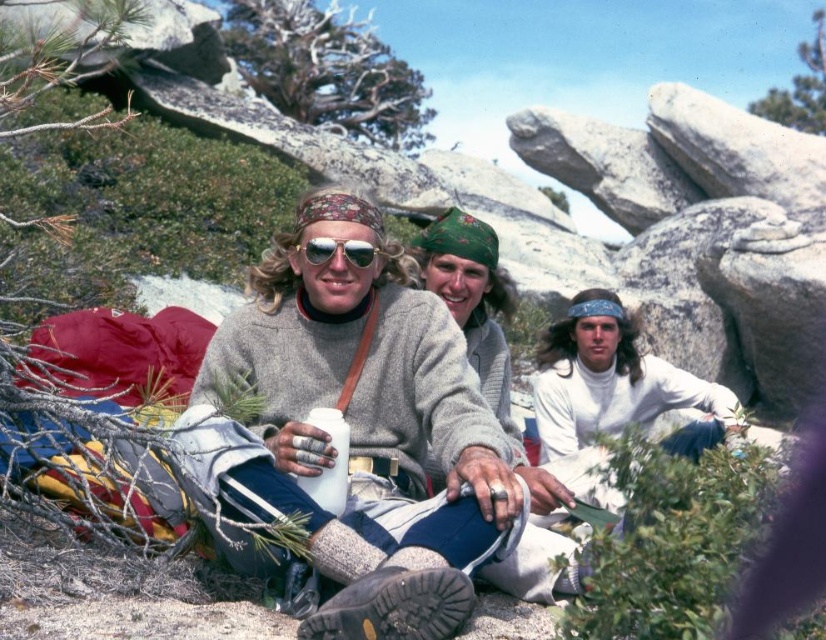
You are a photographer trying to capture a photo of the white matte turtleneck at center and the matte silver goggles at center. Since you want both items to be clearly visible in the frame, which one should you adjust your camera focus on first based on their positions?

The white matte turtleneck at center is to the right of the matte silver goggles at center, so you should focus on the matte silver goggles at center first since it is closer to the left side and adjusting focus from left to right would ensure both are in frame.

You are planning to take a photo of the white matte turtleneck at center and the matte silver goggles at center. Which object should you focus on first if you want to capture both in a single shot without moving the camera?

The white matte turtleneck at center has a larger size compared to matte silver goggles at center, so you should focus on the white matte turtleneck at center first to ensure it is in frame and properly captured before adjusting for the smaller matte silver goggles at center.